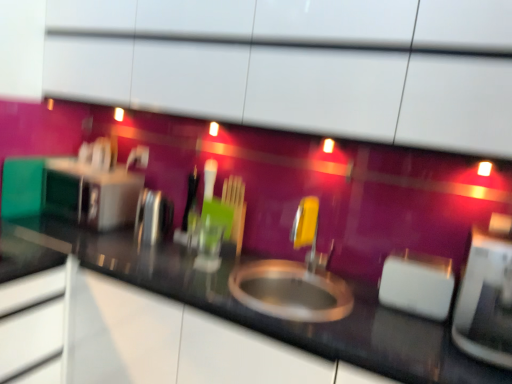
Find the location of a particular element. This screenshot has width=512, height=384. free space to the left of white glossy toaster at right, which is the 1th appliance from right to left is located at coordinates (404, 341).